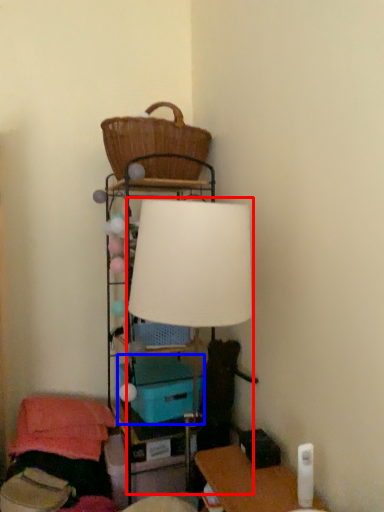
Question: Which object appears closest to the camera in this image, lamp (highlighted by a red box) or storage box (highlighted by a blue box)?

Choices:
 (A) lamp
 (B) storage box

Answer: (A)